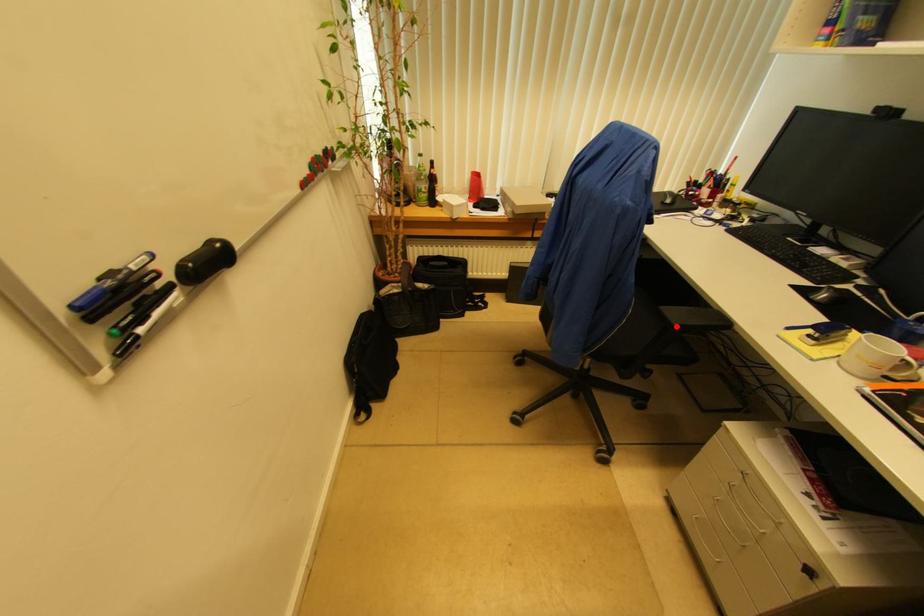
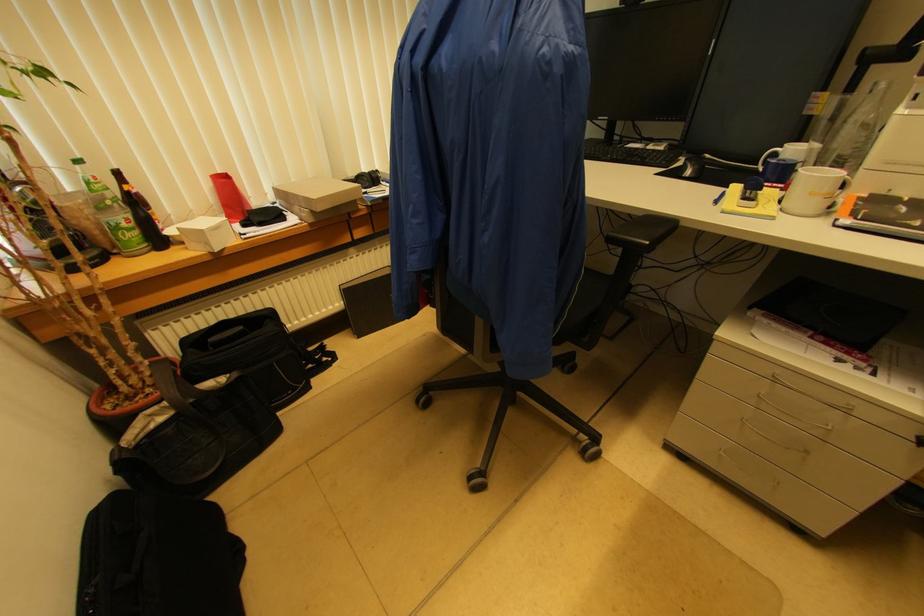
Locate, in the second image, the point that corresponds to the highlighted location in the first image.

(650, 245)